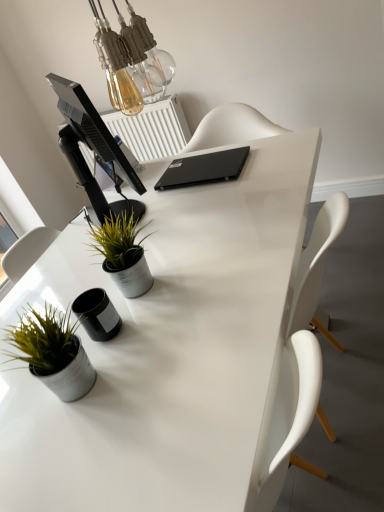
What are the coordinates of `vacant space situated on the left part of matte gray pot at lower left, which is counted as the first houseplant, starting from the bottom` in the screenshot? It's located at [x=18, y=402].